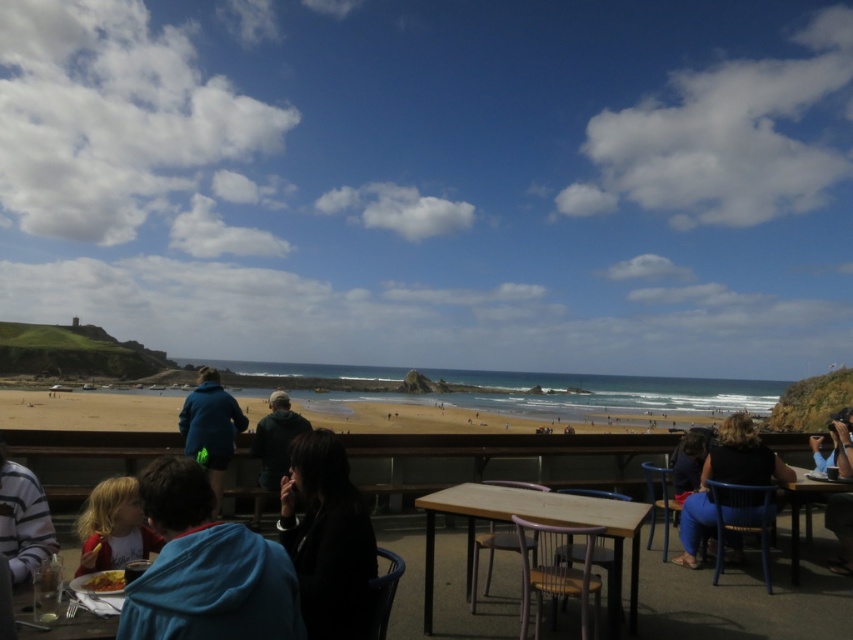
You are a server at the beachfront restaurant and need to deliver a drink to the guest wearing the blue hoodie at lower left. You are currently standing next to the black matte jacket at center. Can you reach the guest without walking more than 25 inches?

The blue hoodie at lower left is 25.90 inches away from the black matte jacket at center. Since the distance is slightly over 25 inches, you would need to walk a bit further than allowed to reach the guest.

You are a photographer standing at the edge of the beach, and you want to take a photo of the black fabric dress at lower right and the blue denim jeans at lower right. If your camera has a maximum focus distance of 3 feet, will both subjects be in focus?

The black fabric dress at lower right is 3.44 feet away from blue denim jeans at lower right. Since the camera can only focus up to 3 feet, the distance between them is too great for both to be in focus simultaneously.

You are a photographer at the beach restaurant terrace. You want to capture a photo of the black fabric dress at lower right and the blue denim jeans at lower right. Which one should you focus on if you want to include more details of the clothing in the frame?

The black fabric dress at lower right might be wider than blue denim jeans at lower right, so focusing on the blue denim jeans at lower right would allow you to include more details in the frame since it is narrower.